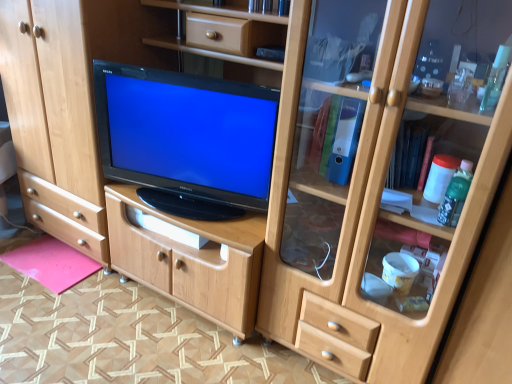
Question: Is the surface of pink matte mat at lower left in direct contact with black glossy television at center?

Choices:
 (A) no
 (B) yes

Answer: (A)

Question: Does pink matte mat at lower left have a smaller size compared to black glossy television at center?

Choices:
 (A) yes
 (B) no

Answer: (A)

Question: Would you consider pink matte mat at lower left to be distant from black glossy television at center?

Choices:
 (A) yes
 (B) no

Answer: (B)

Question: Is pink matte mat at lower left turned away from black glossy television at center?

Choices:
 (A) yes
 (B) no

Answer: (B)

Question: Is pink matte mat at lower left to the right of black glossy television at center from the viewer's perspective?

Choices:
 (A) yes
 (B) no

Answer: (B)

Question: Considering the relative sizes of pink matte mat at lower left and black glossy television at center in the image provided, is pink matte mat at lower left taller than black glossy television at center?

Choices:
 (A) yes
 (B) no

Answer: (B)

Question: From the image's perspective, is black glossy television at center over pink matte mat at lower left?

Choices:
 (A) no
 (B) yes

Answer: (B)

Question: From the image's perspective, is black glossy television at center located beneath pink matte mat at lower left?

Choices:
 (A) no
 (B) yes

Answer: (A)

Question: From a real-world perspective, is black glossy television at center over pink matte mat at lower left?

Choices:
 (A) no
 (B) yes

Answer: (B)

Question: Can you confirm if black glossy television at center is positioned to the right of pink matte mat at lower left?

Choices:
 (A) no
 (B) yes

Answer: (B)

Question: Is black glossy television at center at the left side of pink matte mat at lower left?

Choices:
 (A) no
 (B) yes

Answer: (A)

Question: Are black glossy television at center and pink matte mat at lower left beside each other?

Choices:
 (A) yes
 (B) no

Answer: (B)

Question: Does point (96, 268) appear closer or farther from the camera than point (257, 167)?

Choices:
 (A) closer
 (B) farther

Answer: (B)